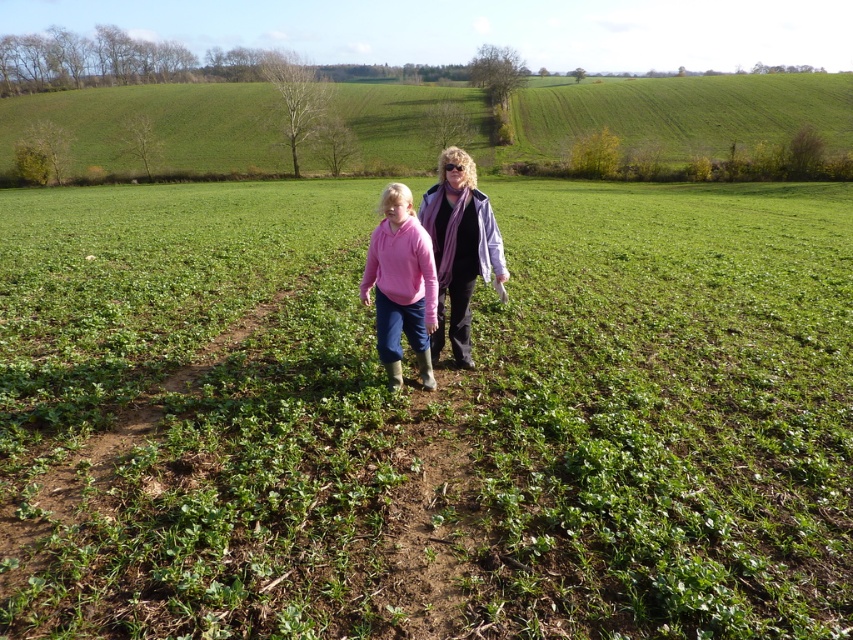
What is the 2D coordinate of the green grass at center?

The 2D coordinate of the green grass at center is at point (425, 419).

You are standing at the point marked by the coordinates point [425,419]. Based on the scene description, what would you most likely see around you?

You would see green grass at center around you, as the point [425,419] indicates green grass at center.

You are a photographer trying to capture a closeup of the green grass at center and the matte purple scarf at center. Which object should you focus on to ensure both are in sharp focus?

The green grass at center is much taller than the matte purple scarf at center, so focusing on the green grass at center will ensure both are in sharp focus.